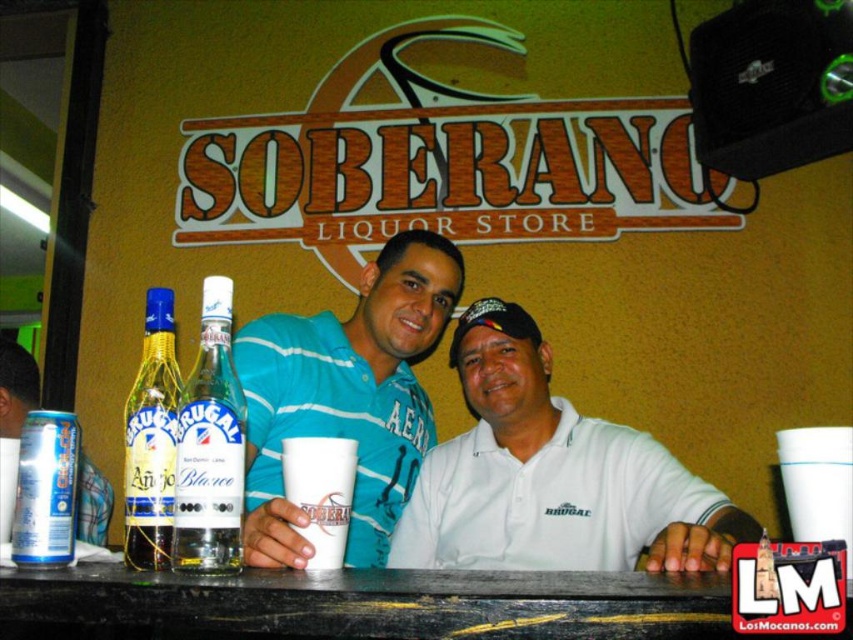
Who is more forward, (x=361, y=394) or (x=299, y=452)?

Point (x=299, y=452)

Image resolution: width=853 pixels, height=640 pixels. I want to click on teal striped polo shirt at center, so click(x=346, y=396).

The height and width of the screenshot is (640, 853). In order to click on teal striped polo shirt at center in this screenshot , I will do `click(346, 396)`.

Is clear glass bottle at center to the right of matte glass bottle at left from the viewer's perspective?

Yes, clear glass bottle at center is to the right of matte glass bottle at left.

Is point (210, 444) positioned after point (79, 481)?

That is False.

The height and width of the screenshot is (640, 853). I want to click on clear glass bottle at center, so coord(210,445).

Is point (140, 502) closer to viewer compared to point (65, 460)?

No, it is not.

Who is lower down, clear glass bottle at left or silver metallic can at lower left?

silver metallic can at lower left is below.

Image resolution: width=853 pixels, height=640 pixels. I want to click on clear glass bottle at left, so click(151, 440).